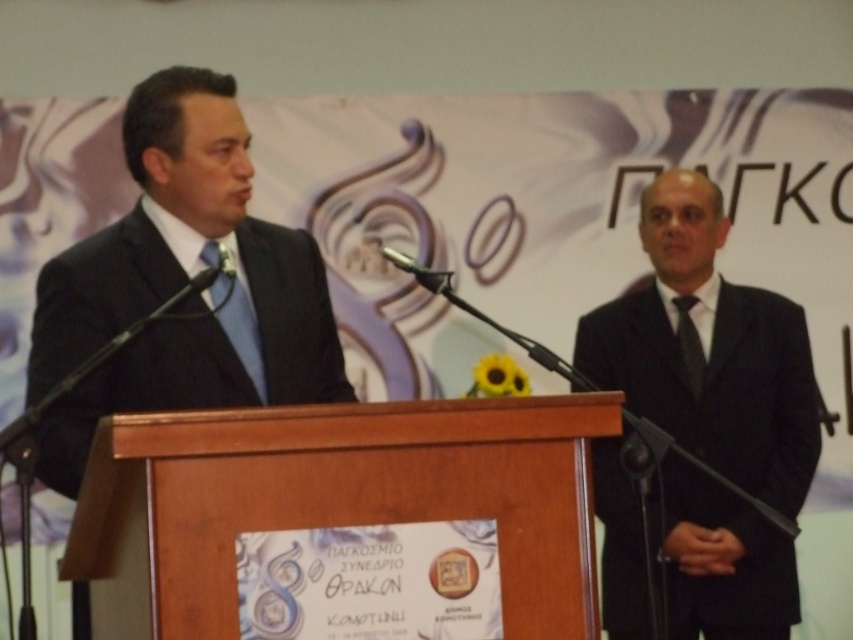
You are a photographer at the event and need to position a spotlight on the black textured suit at left. Using the coordinate system where the bottom left corner is the origin, can you confirm if the point at coordinates (180, 284) is the correct location for the spotlight?

Yes, the point at coordinates (180, 284) corresponds to the black textured suit at left, so placing the spotlight there would illuminate it correctly.

You are a tailor observing a formal event. You notice two accessories on the men at the podium. The blue silk tie at center and the metallic at left. Which accessory is wider?

The blue silk tie at center is wider than the metallic at left.

You are a photographer at the event and need to capture a photo where both the black textured tie at right and the metallic at left are visible. Since the podium is in the way, which tie should you move slightly to the side to ensure both are visible?

The black textured tie at right is positioned on the right side of metallic at left. To ensure both are visible, you should move the metallic at left slightly to the left, as it is currently blocking the view of the black textured tie at right.